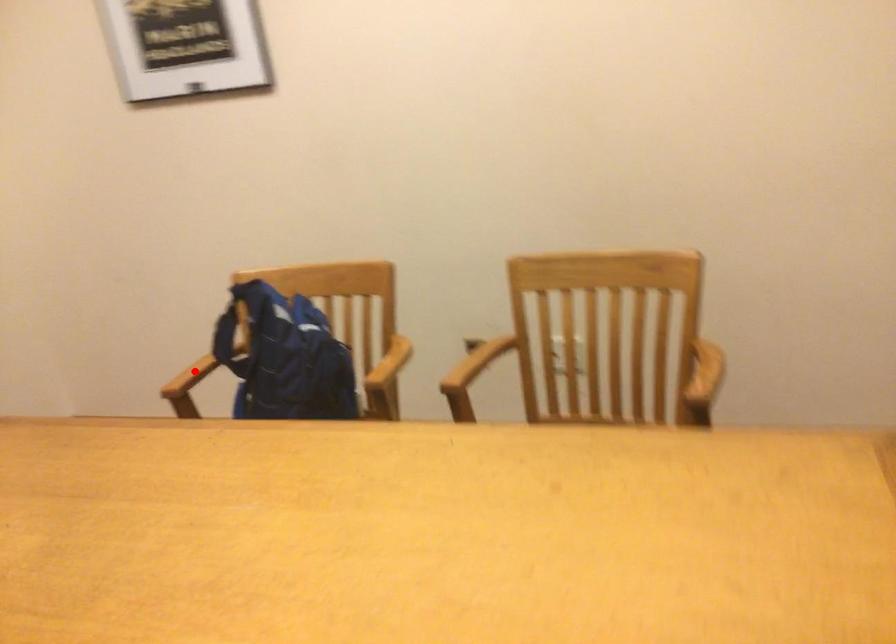
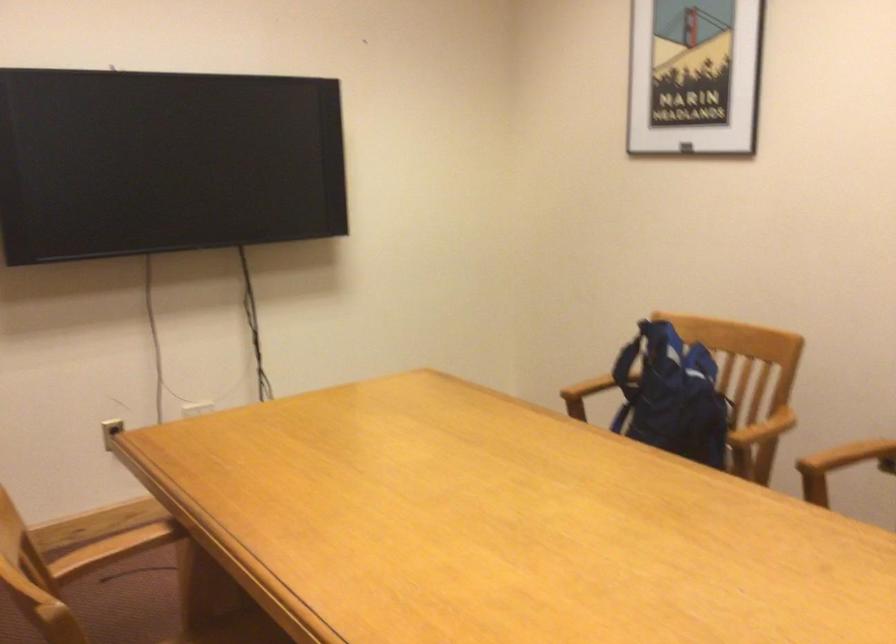
Question: I am providing you with two images of the same scene from different viewpoints. In image1, a red point is highlighted. Considering the same 3D point in image2, which of the following is correct?

Choices:
 (A) It is closer
 (B) It is farther

Answer: (B)